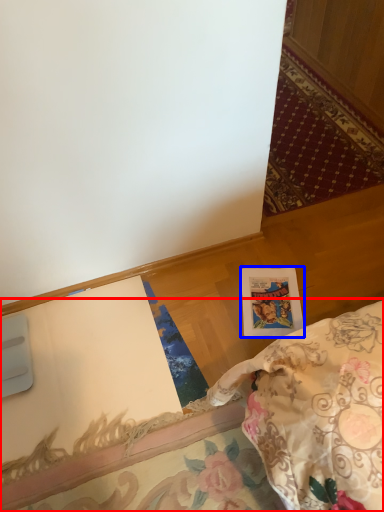
Question: Which point is closer to the camera, furniture (highlighted by a red box) or postcard (highlighted by a blue box)?

Choices:
 (A) furniture
 (B) postcard

Answer: (A)